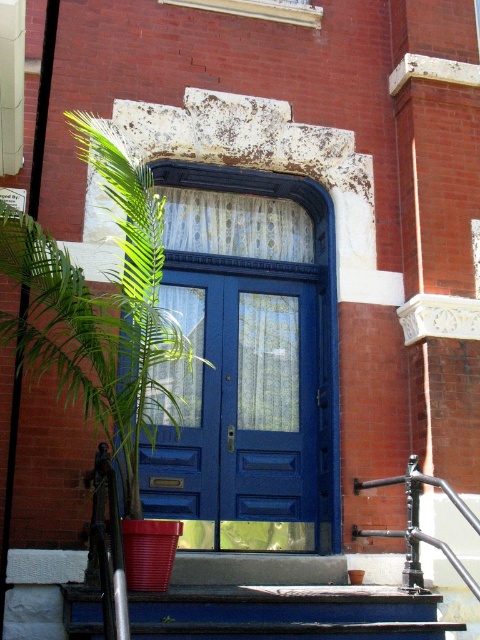
You are a delivery person trying to reach the blue glossy door at center to drop off a package. There is a green leafy plant at left in your way. Can you walk around the plant to access the door?

The blue glossy door at center is positioned under green leafy plant at left, so the plant is above the door. Since the plant is above, you can walk directly to the door without needing to go around it.

You are a delivery person approaching the blue double door. You need to place a package on the green leafy plant at left and the smooth blue stairs at center. Which location is higher up?

The green leafy plant at left is located above the smooth blue stairs at center, so placing the package on the green leafy plant at left would be higher up.

You are standing in front of the red brick building and want to enter through the blue glossy door at center. Are the smooth blue stairs at center in front of or behind the door?

The smooth blue stairs at center are behind the blue glossy door at center because the door is closer to you than the stairs.